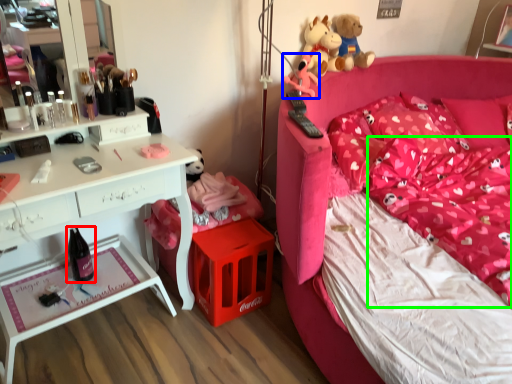
Question: Which object is the closest to the wine bottle (highlighted by a red box)? Choose among these: toy (highlighted by a blue box) or mattress (highlighted by a green box).

Choices:
 (A) toy
 (B) mattress

Answer: (A)